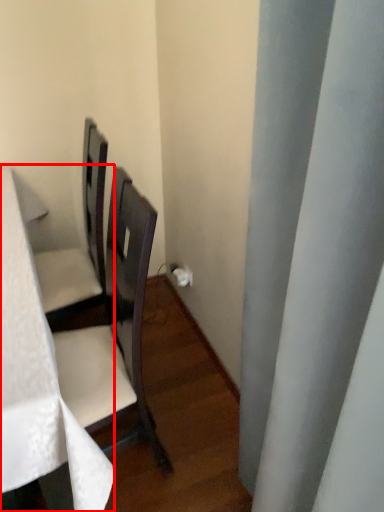
Question: Where is table (annotated by the red box) located in relation to curtain in the image?

Choices:
 (A) left
 (B) right

Answer: (A)